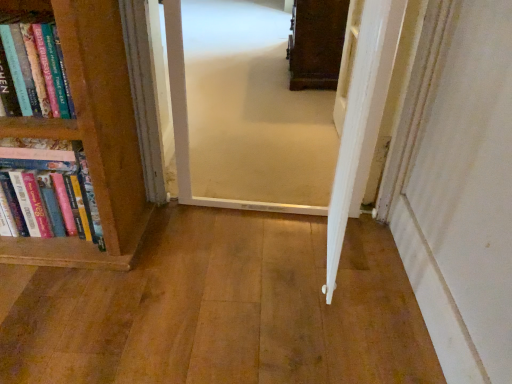
Question: Which is correct: wooden floor at center, arranged as the second corridor when viewed from the top, is inside carpeted corridor at center, the first corridor from the top, or outside of it?

Choices:
 (A) outside
 (B) inside

Answer: (A)

Question: Is point (89, 319) closer or farther from the camera than point (181, 91)?

Choices:
 (A) closer
 (B) farther

Answer: (A)

Question: Estimate the real-world distances between objects in this image. Which object is farther from the wooden floor at center, arranged as the second corridor when viewed from the top?

Choices:
 (A) carpeted corridor at center, which appears as the second corridor when ordered from the bottom
 (B) hardcover books at left

Answer: (A)

Question: Which is farther from the carpeted corridor at center, which appears as the second corridor when ordered from the bottom?

Choices:
 (A) wooden floor at center, which ranks as the first corridor in bottom-to-top order
 (B) hardcover books at left

Answer: (B)